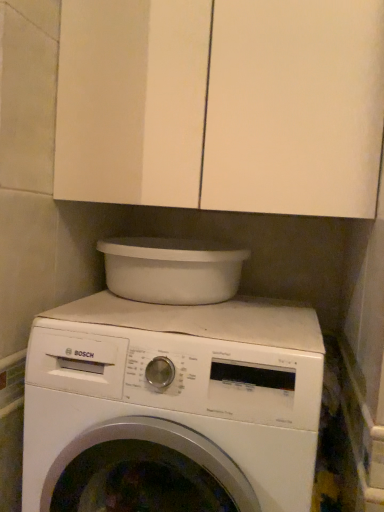
Question: Does white plastic basin at upper center have a greater width compared to white matte washing machine at center?

Choices:
 (A) no
 (B) yes

Answer: (A)

Question: Does white plastic basin at upper center lie in front of white matte washing machine at center?

Choices:
 (A) no
 (B) yes

Answer: (A)

Question: From the image's perspective, is white plastic basin at upper center on white matte washing machine at center?

Choices:
 (A) no
 (B) yes

Answer: (B)

Question: Can you see white plastic basin at upper center touching white matte washing machine at center?

Choices:
 (A) yes
 (B) no

Answer: (B)

Question: Is the depth of white plastic basin at upper center greater than that of white matte washing machine at center?

Choices:
 (A) no
 (B) yes

Answer: (B)

Question: From a real-world perspective, is white plastic basin at upper center physically located above or below white matte washing machine at center?

Choices:
 (A) below
 (B) above

Answer: (B)

Question: From the image's perspective, is white plastic basin at upper center above or below white matte washing machine at center?

Choices:
 (A) above
 (B) below

Answer: (A)

Question: Is white plastic basin at upper center wider or thinner than white matte washing machine at center?

Choices:
 (A) thin
 (B) wide

Answer: (A)

Question: Based on their positions, is white plastic basin at upper center located to the left or right of white matte washing machine at center?

Choices:
 (A) right
 (B) left

Answer: (B)

Question: In terms of height, does white matte cabinet at upper center look taller or shorter compared to white matte washing machine at center?

Choices:
 (A) tall
 (B) short

Answer: (B)

Question: Looking at their shapes, would you say white matte cabinet at upper center is wider or thinner than white matte washing machine at center?

Choices:
 (A) thin
 (B) wide

Answer: (A)

Question: In terms of size, does white matte cabinet at upper center appear bigger or smaller than white matte washing machine at center?

Choices:
 (A) small
 (B) big

Answer: (A)

Question: From a real-world perspective, is white matte cabinet at upper center above or below white matte washing machine at center?

Choices:
 (A) above
 (B) below

Answer: (A)

Question: Is point tap(120, 381) positioned closer to the camera than point tap(158, 192)?

Choices:
 (A) farther
 (B) closer

Answer: (B)

Question: From a real-world perspective, is white matte washing machine at center physically located above or below white matte cabinet at upper center?

Choices:
 (A) above
 (B) below

Answer: (B)